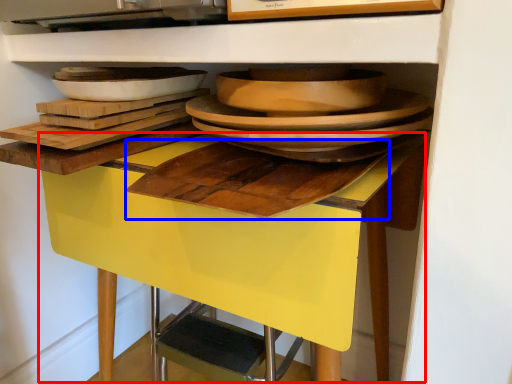
Question: Which of the following is the closest to the observer, table (highlighted by a red box) or cutting board (highlighted by a blue box)?

Choices:
 (A) table
 (B) cutting board

Answer: (B)